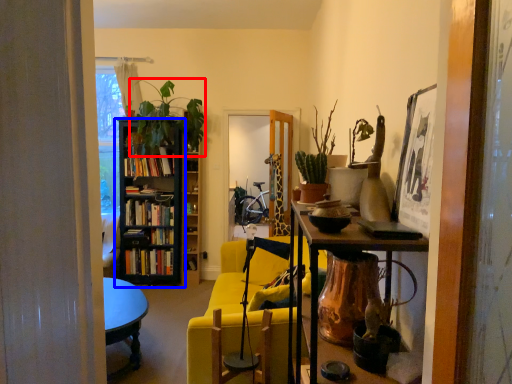
Question: Which of the following is the farthest to the observer, plant (highlighted by a red box) or bookcase (highlighted by a blue box)?

Choices:
 (A) plant
 (B) bookcase

Answer: (B)